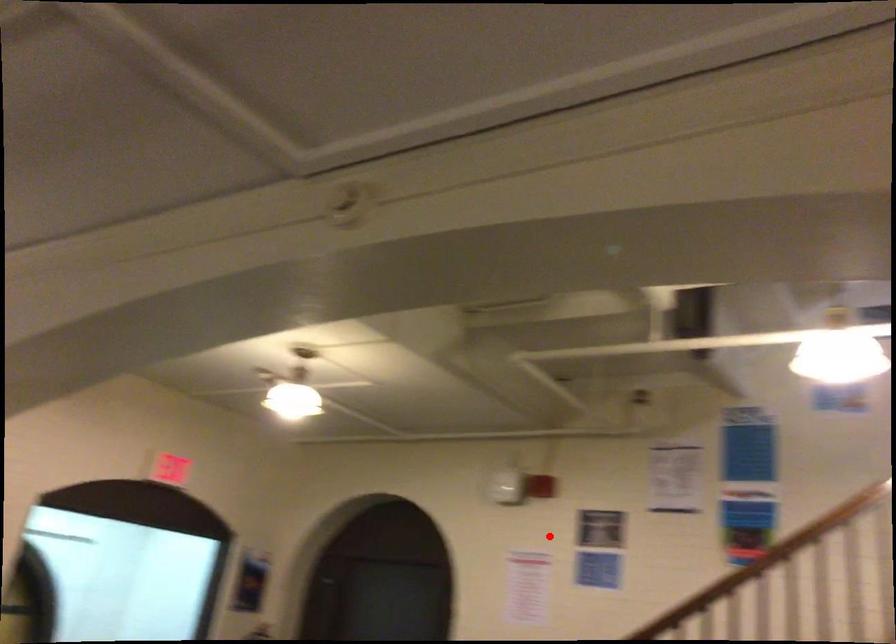
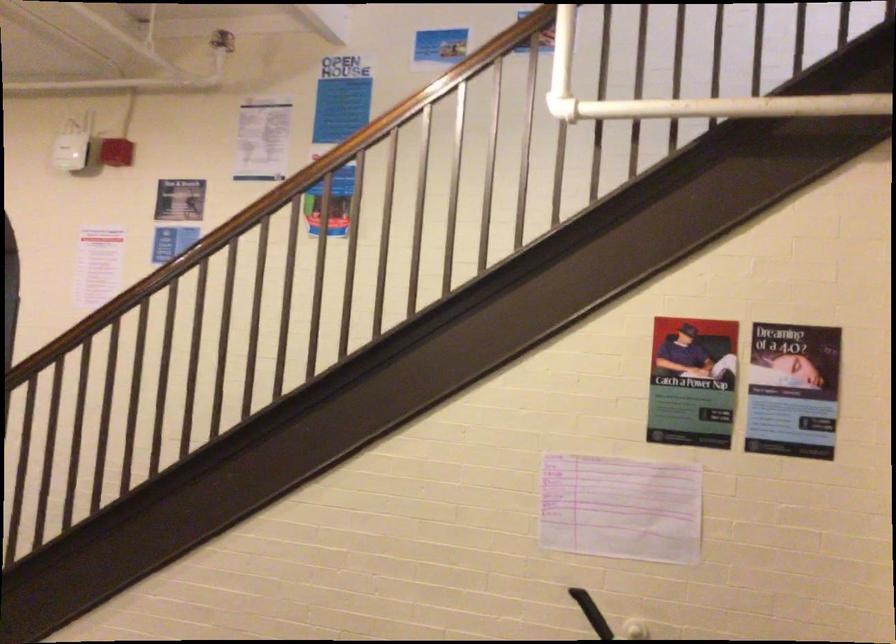
Find the pixel in the second image that matches the highlighted location in the first image.

(108, 154)